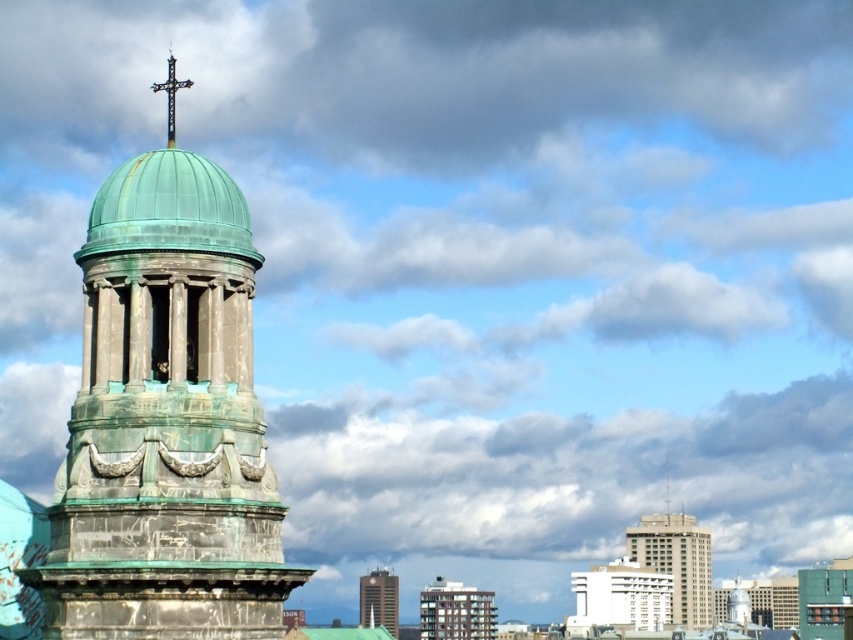
In the scene shown: You are an architect analyzing this cityscape. You notice the green patina stone tower at left and the black metal cross at upper center. Which object is positioned to the left of the other?

The black metal cross at upper center is positioned to the left of the green patina stone tower at left because the green patina stone tower at left is to the right of the black metal cross at upper center.

You are an architect analyzing the cityscape. You notice the green patina stone tower at left and the black metal cross at upper center. Which object would appear larger in your field of view?

The green patina stone tower at left appears larger in your field of view because it is closer to the viewer than the black metal cross at upper center.

Based on the coordinates provided, can you identify which object in the scene corresponds to the point at (166, 422)?

The point at (166, 422) corresponds to the green patina stone tower at left.